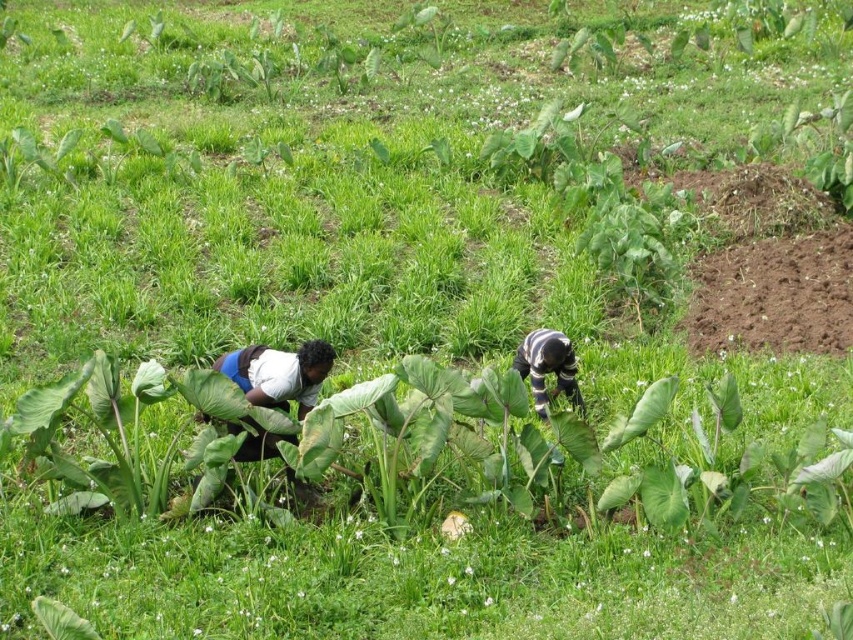
You are a farmer observing two workers in your field. You notice the white cotton shirt at lower left and the striped fabric person at center. Which worker is closer to the ground based on their position?

The white cotton shirt at lower left is positioned under striped fabric person at center, so the worker wearing the white cotton shirt at lower left is closer to the ground.

You are standing in the field and want to pick up the tool located at point (302, 364) and the tool at point (529, 362). Which tool will you reach first if you move directly towards them?

The tool located at point (302, 364) will be reached first because it is closer to you than the tool at point (529, 362).

You are standing at the camera position and want to hand a tool to the person wearing the white cotton shirt at lower left. Can you reach them if your longest arm span is 2 meters?

The white cotton shirt at lower left is 7.67 meters away from camera, so no, you cannot reach them with an arm span of 2 meters.